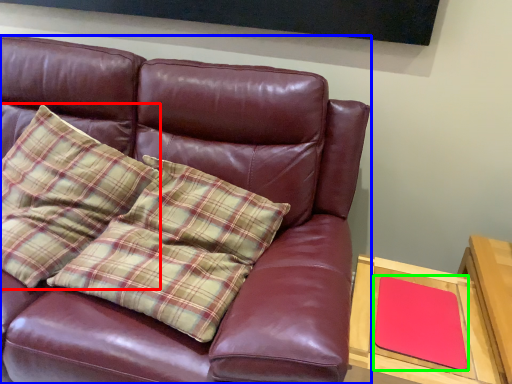
Question: Which is farther away from pillow (highlighted by a red box)? studio couch (highlighted by a blue box) or pad (highlighted by a green box)?

Choices:
 (A) studio couch
 (B) pad

Answer: (B)